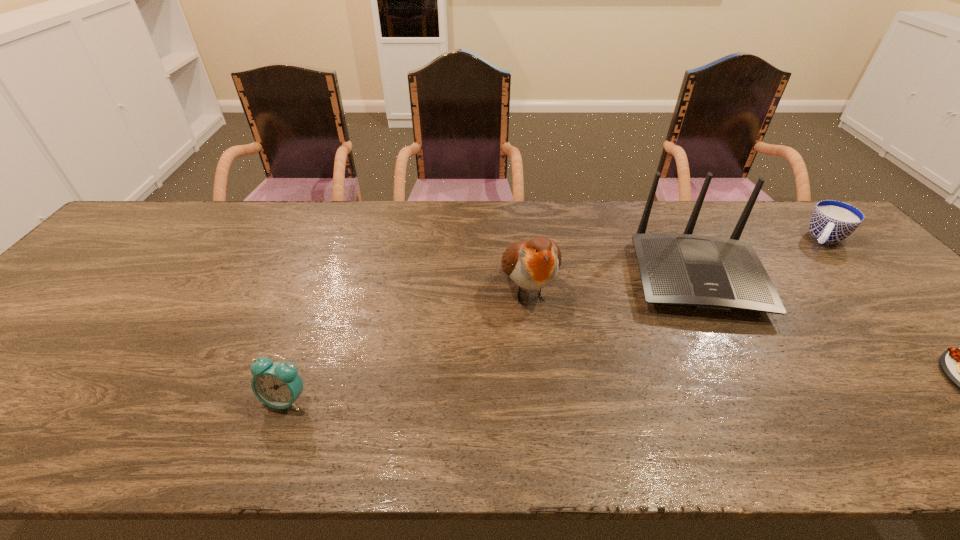
This screenshot has width=960, height=540. Find the location of `blank area at the near edge`. blank area at the near edge is located at coordinates (367, 386).

In order to click on free region at the left edge of the desktop in this screenshot , I will do `click(48, 343)`.

In the image, there is a desktop. Identify the location of free region at the right edge. The image size is (960, 540). (855, 298).

In the image, there is a desktop. Identify the location of vacant space at the far right corner. (782, 208).

Locate an element on the screen. The width and height of the screenshot is (960, 540). unoccupied position between the third shortest object and the third object from left to right is located at coordinates (490, 339).

Find the location of `empty space between the bird and the alarm clock`. empty space between the bird and the alarm clock is located at coordinates (407, 345).

Locate an element on the screen. unoccupied area between the third object from right to left and the third tallest object is located at coordinates (490, 339).

At what (x,y) coordinates should I click in order to perform the action: click on vacant point located between the bird and the third object from left to right. Please return your answer as a coordinate pair (x, y). This screenshot has height=540, width=960. Looking at the image, I should click on (611, 283).

Where is `free space between the fourth object from right to left and the third object from right to left`? Image resolution: width=960 pixels, height=540 pixels. free space between the fourth object from right to left and the third object from right to left is located at coordinates (611, 283).

Identify which object is located as the third nearest to the bird. Please provide its 2D coordinates. Your answer should be formatted as a tuple, i.e. [(x, y)], where the tuple contains the x and y coordinates of a point satisfying the conditions above.

[(832, 221)]